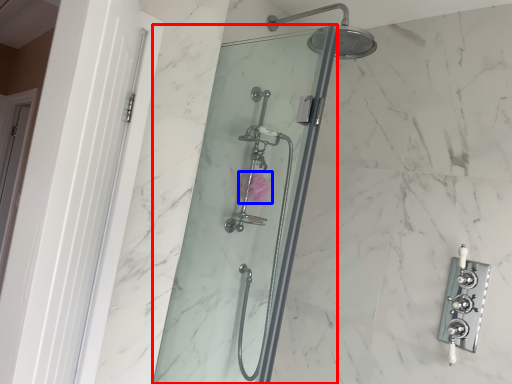
Question: Which object is further to the camera taking this photo, shower door (highlighted by a red box) or flower (highlighted by a blue box)?

Choices:
 (A) shower door
 (B) flower

Answer: (B)